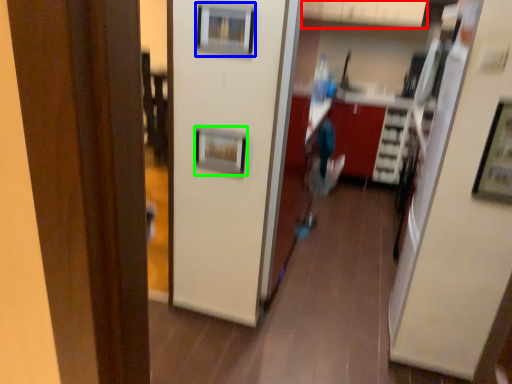
Question: Which is nearer to the cabinetry (highlighted by a red box)? picture frame (highlighted by a blue box) or picture frame (highlighted by a green box).

Choices:
 (A) picture frame
 (B) picture frame

Answer: (A)